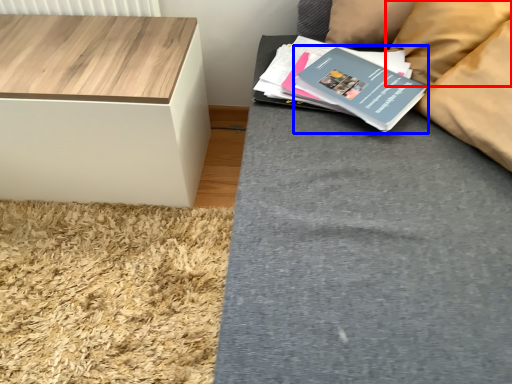
Question: Which of the following is the farthest to the observer, pillow (highlighted by a red box) or paperback book (highlighted by a blue box)?

Choices:
 (A) pillow
 (B) paperback book

Answer: (A)